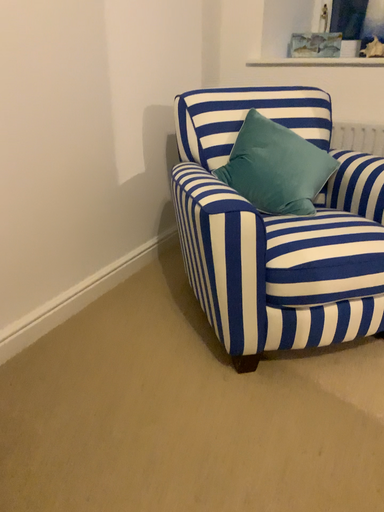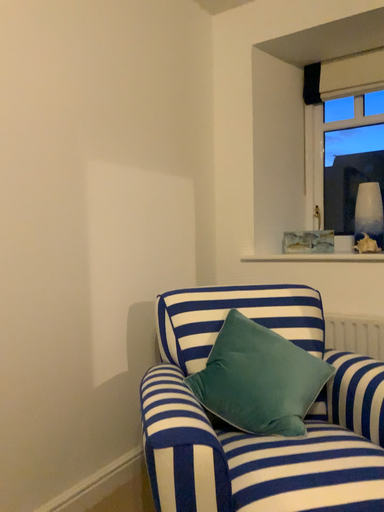
Question: Which way did the camera rotate in the video?

Choices:
 (A) rotated upward
 (B) rotated downward

Answer: (A)